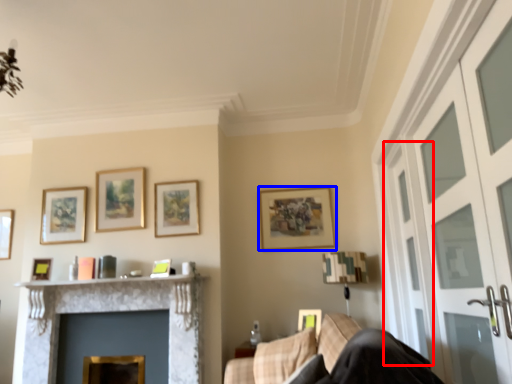
Question: Among these objects, which one is farthest to the camera, screen door (highlighted by a red box) or picture frame (highlighted by a blue box)?

Choices:
 (A) screen door
 (B) picture frame

Answer: (B)